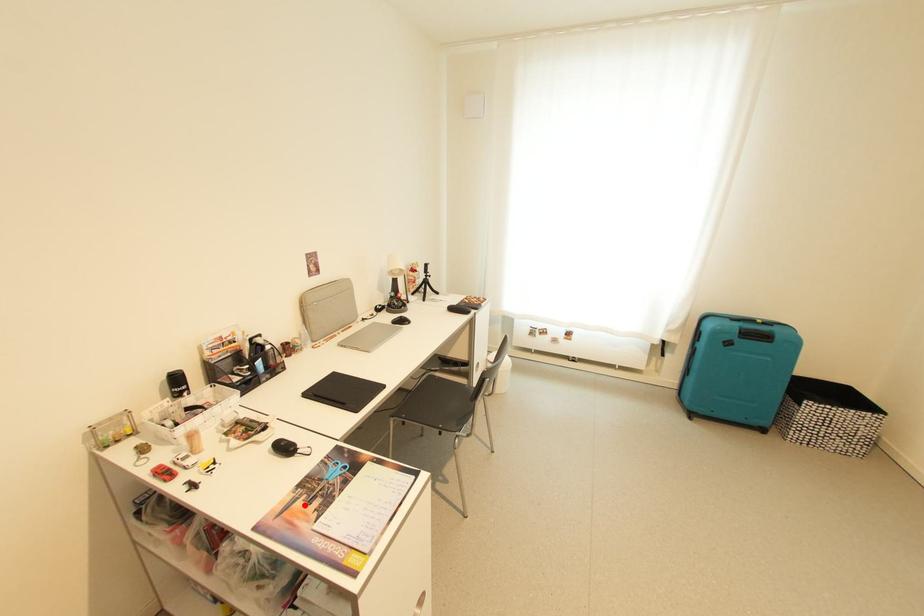
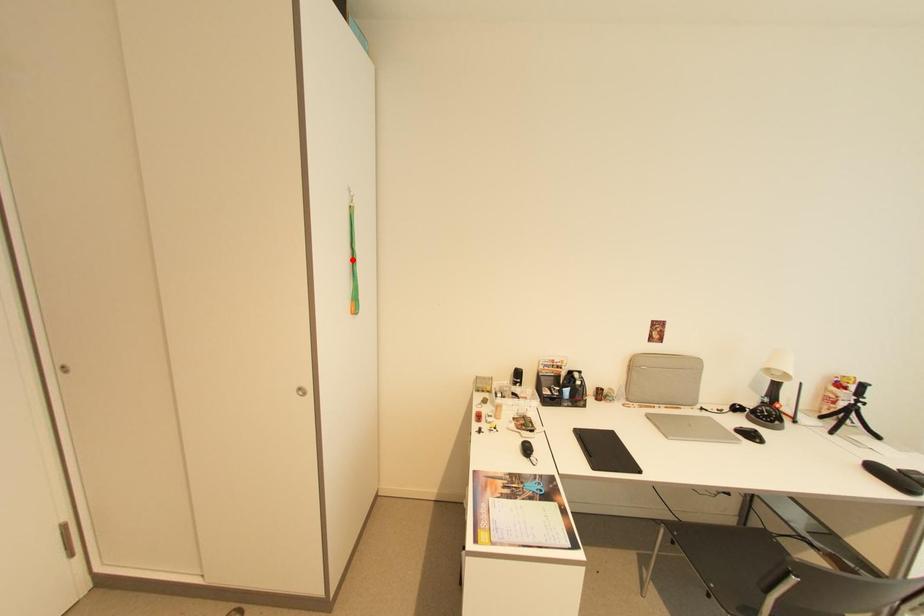
I am providing you with two images of the same scene from different viewpoints. A red point is marked on the first image and another point is marked on the second image. Is the marked point in image1 the same physical position as the marked point in image2?

No